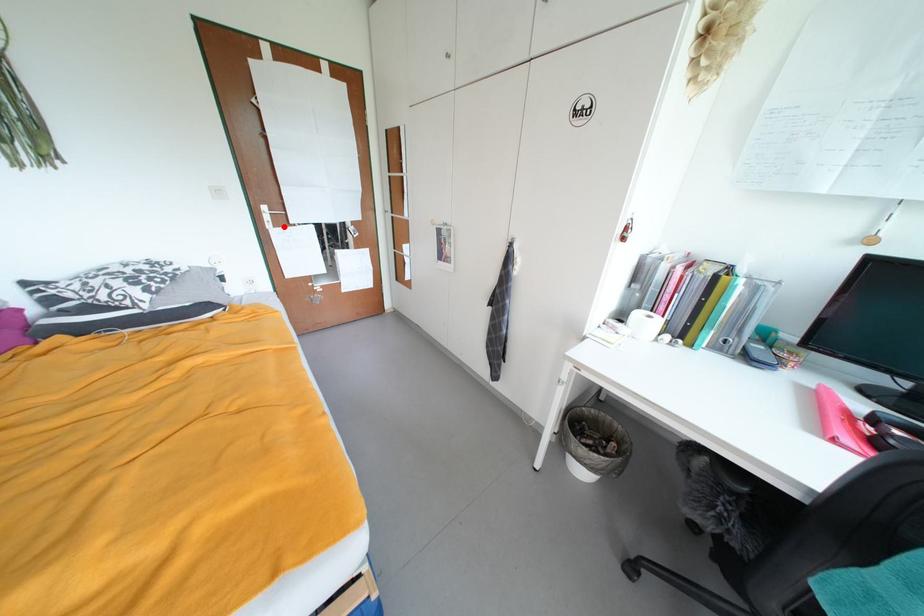
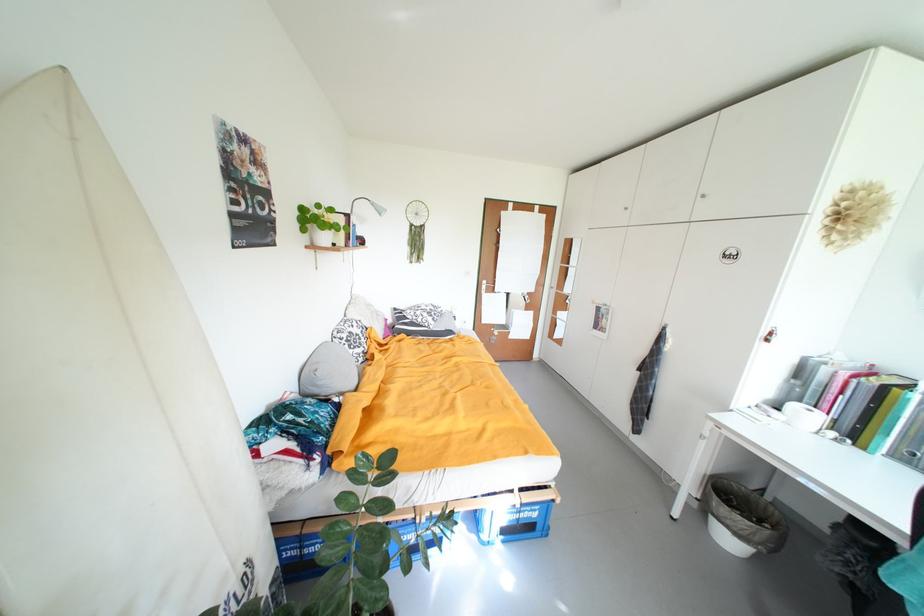
Question: I am providing you with two images of the same scene from different viewpoints. A red point is shown in image1. For the corresponding object point in image2, is it positioned nearer or farther from the camera?

Choices:
 (A) Nearer
 (B) Farther

Answer: (B)